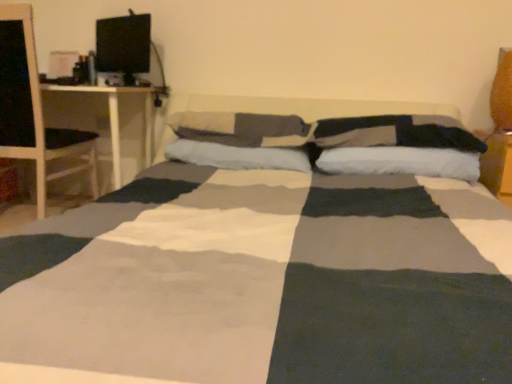
What do you see at coordinates (401, 162) in the screenshot?
I see `white soft pillow at center, which ranks as the second pillow in right-to-left order` at bounding box center [401, 162].

At what (x,y) coordinates should I click in order to perform the action: click on velvet orange pillow at upper right, the 1th pillow from the right. Please return your answer as a coordinate pair (x, y). This screenshot has width=512, height=384. Looking at the image, I should click on (502, 93).

Locate an element on the screen. soft cotton pillow at center, the 1th pillow from the left is located at coordinates (237, 156).

Would you say black glossy computer monitor at upper left is inside or outside white soft pillow at center, acting as the 2th pillow starting from the left?

black glossy computer monitor at upper left is spatially situated outside white soft pillow at center, acting as the 2th pillow starting from the left.

Does point (142, 43) appear closer or farther from the camera than point (252, 135)?

Point (142, 43) is positioned farther from the camera compared to point (252, 135).

Is black glossy computer monitor at upper left wider than white soft pillow at center, acting as the 2th pillow starting from the left?

No, black glossy computer monitor at upper left is not wider than white soft pillow at center, acting as the 2th pillow starting from the left.

From a real-world perspective, which object stands above the other?

In real-world perspective, black glossy computer monitor at upper left is above.

Would you say soft cotton pillow at center, the 1th pillow from the left, is to the left or to the right of white soft pillow at center, acting as the 2th pillow starting from the left, in the picture?

soft cotton pillow at center, the 1th pillow from the left, is to the left of white soft pillow at center, acting as the 2th pillow starting from the left.

Is soft cotton pillow at center, which is the fifth pillow in right-to-left order, oriented away from white soft pillow at center, the fourth pillow when ordered from right to left?

No.

Is soft cotton pillow at center, which is the fifth pillow in right-to-left order, with white soft pillow at center, acting as the 2th pillow starting from the left?

Yes, soft cotton pillow at center, which is the fifth pillow in right-to-left order, is right next to white soft pillow at center, acting as the 2th pillow starting from the left, and making contact.

Which object is more forward, soft cotton pillow at center, the 1th pillow from the left, or white soft pillow at center, acting as the 2th pillow starting from the left?

Positioned in front is soft cotton pillow at center, the 1th pillow from the left.

Does white soft pillow at center, which ranks as the second pillow in right-to-left order, appear on the right side of velvet orange pillow at upper right, the 1th pillow from the right?

No.

From a real-world perspective, between white soft pillow at center, the fourth pillow positioned from the left, and velvet orange pillow at upper right, the fifth pillow when ordered from left to right, who is vertically higher?

From a 3D spatial view, velvet orange pillow at upper right, the fifth pillow when ordered from left to right, is above.

Is white soft pillow at center, the fourth pillow positioned from the left, closer to the viewer compared to velvet orange pillow at upper right, the 1th pillow from the right?

Yes, white soft pillow at center, the fourth pillow positioned from the left, is closer to the camera.

Is point (433, 140) in front of point (505, 146)?

That is True.

Is dark gray fabric pillow at center, the third pillow in the left-to-right sequence, thinner than wooden table at right?

Indeed, dark gray fabric pillow at center, the third pillow in the left-to-right sequence, has a lesser width compared to wooden table at right.

From a real-world perspective, between dark gray fabric pillow at center, the third pillow positioned from the right, and wooden table at right, who is vertically higher?

From a 3D spatial view, dark gray fabric pillow at center, the third pillow positioned from the right, is above.

There is a wooden table at right. Identify the location of the 4th pillow above it (from a real-world perspective). (395, 133).

Between white soft pillow at center, the fourth pillow when ordered from right to left, and wooden table at right, which one appears on the left side from the viewer's perspective?

Positioned to the left is white soft pillow at center, the fourth pillow when ordered from right to left.

Which is correct: white soft pillow at center, acting as the 2th pillow starting from the left, is inside wooden table at right, or outside of it?

white soft pillow at center, acting as the 2th pillow starting from the left, lies outside wooden table at right.

Is wooden table at right at the back of white soft pillow at center, acting as the 2th pillow starting from the left?

white soft pillow at center, acting as the 2th pillow starting from the left, does not have its back to wooden table at right.

Who is smaller, white soft pillow at center, acting as the 2th pillow starting from the left, or wooden table at right?

white soft pillow at center, acting as the 2th pillow starting from the left, is smaller.

From a real-world perspective, is black glossy computer monitor at upper left located beneath soft cotton pillow at center, the 1th pillow from the left?

No.

Is black glossy computer monitor at upper left aimed at soft cotton pillow at center, which is the fifth pillow in right-to-left order?

No, black glossy computer monitor at upper left is not oriented towards soft cotton pillow at center, which is the fifth pillow in right-to-left order.

Does point (113, 65) come behind point (276, 168)?

Yes, point (113, 65) is farther from viewer.

Are black glossy computer monitor at upper left and soft cotton pillow at center, which is the fifth pillow in right-to-left order, located far from each other?

They are positioned close to each other.

Is dark gray fabric pillow at center, the third pillow in the left-to-right sequence, thinner than black glossy computer monitor at upper left?

In fact, dark gray fabric pillow at center, the third pillow in the left-to-right sequence, might be wider than black glossy computer monitor at upper left.

Find the location of a particular element. Image resolution: width=512 pixels, height=384 pixels. pillow that is the 3rd one when counting downward from the black glossy computer monitor at upper left (from the image's perspective) is located at coordinates pos(395,133).

Consider the image. Is dark gray fabric pillow at center, the third pillow positioned from the right, oriented towards black glossy computer monitor at upper left?

No, dark gray fabric pillow at center, the third pillow positioned from the right, is not oriented towards black glossy computer monitor at upper left.

From the picture: From a real-world perspective, which object rests below the other?

From a 3D spatial view, dark gray fabric pillow at center, the third pillow positioned from the right, is below.

Locate an element on the screen. Image resolution: width=512 pixels, height=384 pixels. computer monitor above the white soft pillow at center, acting as the 2th pillow starting from the left (from the image's perspective) is located at coordinates (123, 44).

The image size is (512, 384). I want to click on pillow lying on the left of white soft pillow at center, the fourth pillow when ordered from right to left, so click(x=237, y=156).

From the image, which object appears to be nearer to dark gray fabric pillow at center, the third pillow positioned from the right, white soft pillow at center, the fourth pillow when ordered from right to left, or black glossy computer monitor at upper left?

Among the two, white soft pillow at center, the fourth pillow when ordered from right to left, is located nearer to dark gray fabric pillow at center, the third pillow positioned from the right.

Based on their spatial positions, is dark gray fabric pillow at center, the third pillow positioned from the right, or velvet orange pillow at upper right, the fifth pillow when ordered from left to right, closer to wooden table at right?

velvet orange pillow at upper right, the fifth pillow when ordered from left to right, is closer to wooden table at right.

Which object lies further to the anchor point wooden table at right, white soft pillow at center, the fourth pillow when ordered from right to left, or dark gray fabric pillow at center, the third pillow in the left-to-right sequence?

white soft pillow at center, the fourth pillow when ordered from right to left.

From the image, which object appears to be nearer to soft cotton pillow at center, which is the fifth pillow in right-to-left order, dark gray fabric pillow at center, the third pillow in the left-to-right sequence, or black glossy computer monitor at upper left?

dark gray fabric pillow at center, the third pillow in the left-to-right sequence.

Which object lies further to the anchor point velvet orange pillow at upper right, the 1th pillow from the right, wooden table at right or dark gray fabric pillow at center, the third pillow in the left-to-right sequence?

dark gray fabric pillow at center, the third pillow in the left-to-right sequence, is further to velvet orange pillow at upper right, the 1th pillow from the right.

From the image, which object appears to be farther from wooden table at right, white soft pillow at center, the fourth pillow positioned from the left, or white wood desk at left?

white wood desk at left is positioned further to the anchor wooden table at right.

Which object lies further to the anchor point dark gray fabric pillow at center, the third pillow positioned from the right, black glossy computer monitor at upper left or white soft pillow at center, the fourth pillow positioned from the left?

black glossy computer monitor at upper left is further to dark gray fabric pillow at center, the third pillow positioned from the right.

Estimate the real-world distances between objects in this image. Which object is closer to velvet orange pillow at upper right, the 1th pillow from the right, white wood desk at left or white soft pillow at center, the fourth pillow positioned from the left?

Based on the image, white soft pillow at center, the fourth pillow positioned from the left, appears to be nearer to velvet orange pillow at upper right, the 1th pillow from the right.

The image size is (512, 384). In order to click on pillow located between soft cotton pillow at center, the 1th pillow from the left, and dark gray fabric pillow at center, the third pillow positioned from the right, in the left-right direction in this screenshot , I will do `click(241, 129)`.

Find the location of `computer monitor situated between white wood desk at left and white soft pillow at center, the fourth pillow when ordered from right to left, from left to right`. computer monitor situated between white wood desk at left and white soft pillow at center, the fourth pillow when ordered from right to left, from left to right is located at coordinates (123, 44).

Locate an element on the screen. pillow situated between white wood desk at left and white soft pillow at center, acting as the 2th pillow starting from the left, from left to right is located at coordinates (237, 156).

The image size is (512, 384). What are the coordinates of `table between white soft pillow at center, which ranks as the second pillow in right-to-left order, and velvet orange pillow at upper right, the fifth pillow when ordered from left to right, in the horizontal direction` in the screenshot? It's located at (497, 165).